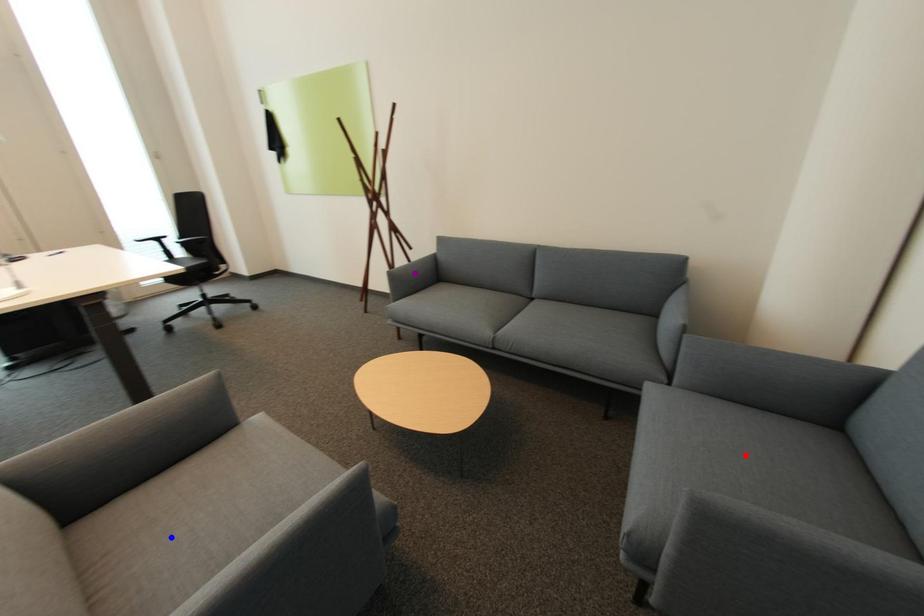
Order these from nearest to farthest:
red point, purple point, blue point

blue point
red point
purple point